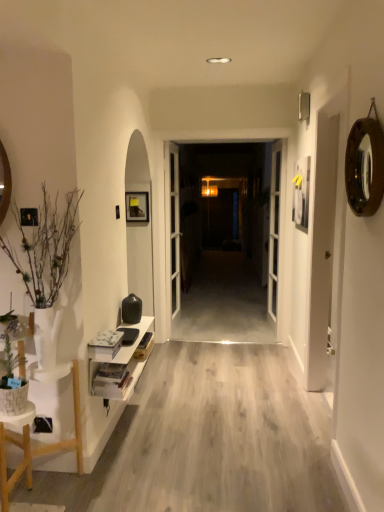
Find the location of `free space in front of transparent glass door at center`. free space in front of transparent glass door at center is located at coordinates (228, 329).